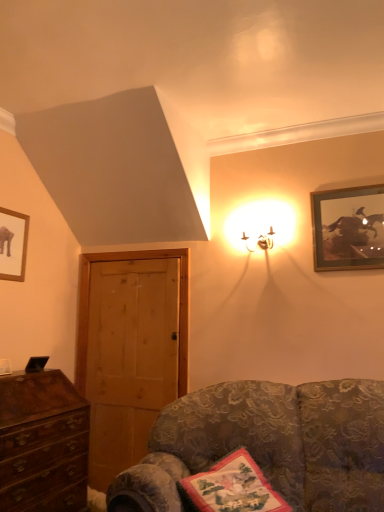
Question: Is mahogany wooden chest of drawers at lower left wider or thinner than wooden door at left?

Choices:
 (A) wide
 (B) thin

Answer: (A)

Question: Based on their positions, is mahogany wooden chest of drawers at lower left located to the left or right of wooden door at left?

Choices:
 (A) left
 (B) right

Answer: (A)

Question: Which is nearer to the wooden door at left?

Choices:
 (A) mahogany wooden chest of drawers at lower left
 (B) metallic gold sconce at upper right
 (C) gold-framed picture at upper right, which is counted as the second picture frame, starting from the left
 (D) velvet floral couch at lower right
 (E) silk floral pillow at lower right

Answer: (A)

Question: Based on their relative distances, which object is nearer to the metallic gold sconce at upper right?

Choices:
 (A) silk floral pillow at lower right
 (B) velvet floral couch at lower right
 (C) gold-framed picture at upper right, the 1th picture frame from the right
 (D) wooden door at left
 (E) mahogany wooden chest of drawers at lower left

Answer: (C)